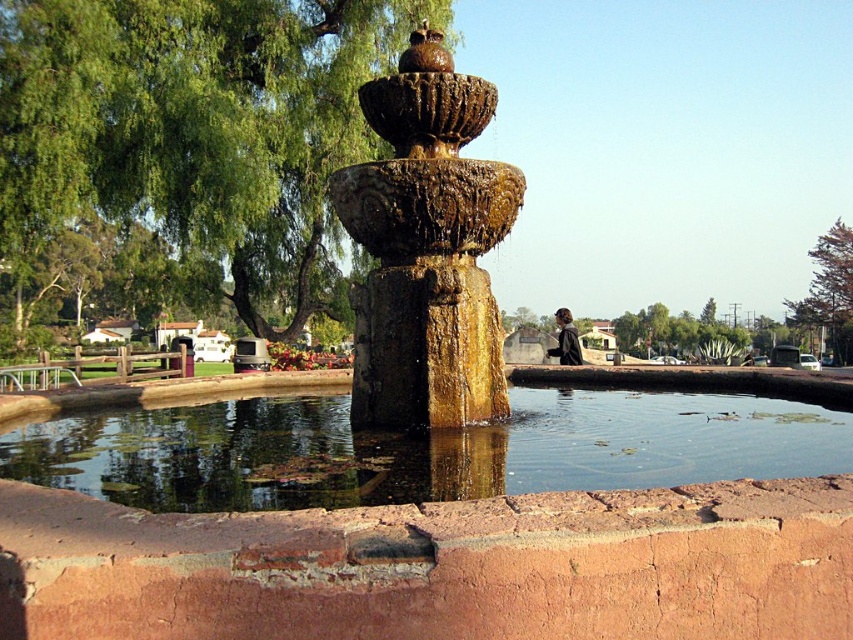
Question: Is green leafy tree at upper left further to the viewer compared to clear water at fountain center?

Choices:
 (A) no
 (B) yes

Answer: (B)

Question: Is golden stone fountain at center behind green leafy tree at upper right?

Choices:
 (A) yes
 (B) no

Answer: (B)

Question: Does clear water at fountain center have a greater width compared to green leafy tree at upper right?

Choices:
 (A) yes
 (B) no

Answer: (B)

Question: Which is farther from the golden stone fountain at center?

Choices:
 (A) clear water at fountain center
 (B) green leafy tree at upper left

Answer: (B)

Question: Which object appears closest to the camera in this image?

Choices:
 (A) green leafy tree at upper left
 (B) green leafy tree at upper right
 (C) golden stone fountain at center

Answer: (C)

Question: Estimate the real-world distances between objects in this image. Which object is farther from the clear water at fountain center?

Choices:
 (A) golden stone fountain at center
 (B) green leafy tree at upper left
 (C) green leafy tree at upper right

Answer: (C)